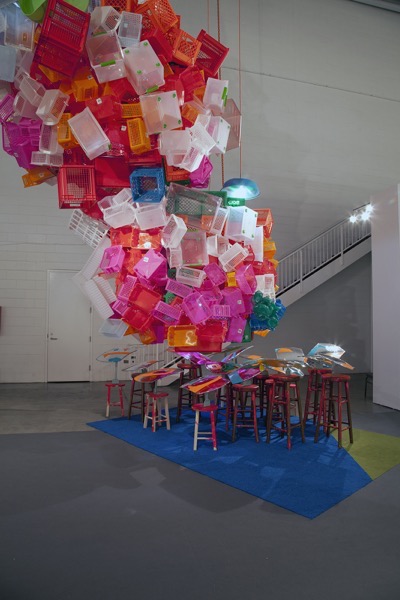
Where is `blue crate/bin`? blue crate/bin is located at coordinates (147, 185).